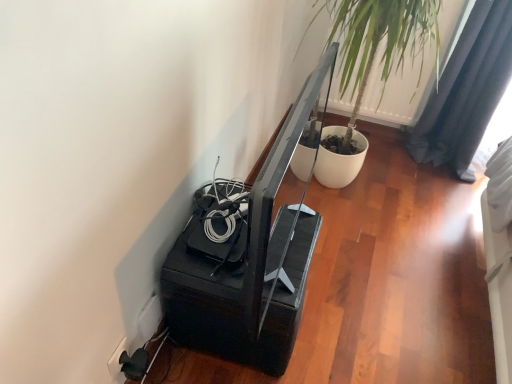
Question: Is white plastic electric outlet at lower left, arranged as the 2th electric outlet when viewed from the right, with green leafy plant at upper right?

Choices:
 (A) yes
 (B) no

Answer: (B)

Question: Can you confirm if white plastic electric outlet at lower left, arranged as the 2th electric outlet when viewed from the right, is taller than green leafy plant at upper right?

Choices:
 (A) no
 (B) yes

Answer: (A)

Question: From the image's perspective, is white plastic electric outlet at lower left, arranged as the 2th electric outlet when viewed from the right, located beneath green leafy plant at upper right?

Choices:
 (A) no
 (B) yes

Answer: (B)

Question: Is white plastic electric outlet at lower left, arranged as the 2th electric outlet when viewed from the right, to the right of green leafy plant at upper right from the viewer's perspective?

Choices:
 (A) no
 (B) yes

Answer: (A)

Question: Can green leafy plant at upper right be found inside white plastic electric outlet at lower left, the first electric outlet when ordered from left to right?

Choices:
 (A) yes
 (B) no

Answer: (B)

Question: Does point (139, 312) appear closer or farther from the camera than point (501, 57)?

Choices:
 (A) closer
 (B) farther

Answer: (A)

Question: Is white plastic electric outlet at lower left, the 2th electric outlet in the left-to-right sequence, wider or thinner than dark gray fabric curtain at upper right?

Choices:
 (A) thin
 (B) wide

Answer: (A)

Question: Is white plastic electric outlet at lower left, the 2th electric outlet in the left-to-right sequence, taller or shorter than dark gray fabric curtain at upper right?

Choices:
 (A) tall
 (B) short

Answer: (B)

Question: Considering their positions, is white plastic electric outlet at lower left, the 1th electric outlet viewed from the right, located in front of or behind dark gray fabric curtain at upper right?

Choices:
 (A) behind
 (B) front

Answer: (B)

Question: Is white plastic electric outlet at lower left, the first electric outlet when ordered from left to right, to the left or to the right of white plastic electric outlet at lower left, the 2th electric outlet in the left-to-right sequence, in the image?

Choices:
 (A) right
 (B) left

Answer: (B)

Question: Considering the positions of white plastic electric outlet at lower left, arranged as the 2th electric outlet when viewed from the right, and white plastic electric outlet at lower left, the 2th electric outlet in the left-to-right sequence, in the image, is white plastic electric outlet at lower left, arranged as the 2th electric outlet when viewed from the right, taller or shorter than white plastic electric outlet at lower left, the 2th electric outlet in the left-to-right sequence,?

Choices:
 (A) tall
 (B) short

Answer: (B)

Question: Is white plastic electric outlet at lower left, the first electric outlet when ordered from left to right, inside or outside of white plastic electric outlet at lower left, the 1th electric outlet viewed from the right?

Choices:
 (A) inside
 (B) outside

Answer: (B)

Question: From the image's perspective, is white plastic electric outlet at lower left, arranged as the 2th electric outlet when viewed from the right, positioned above or below white plastic electric outlet at lower left, the 1th electric outlet viewed from the right?

Choices:
 (A) above
 (B) below

Answer: (B)

Question: Considering the relative positions of green leafy plant at upper right and white plastic electric outlet at lower left, arranged as the 2th electric outlet when viewed from the right, in the image provided, is green leafy plant at upper right to the left or to the right of white plastic electric outlet at lower left, arranged as the 2th electric outlet when viewed from the right,?

Choices:
 (A) right
 (B) left

Answer: (A)

Question: Is green leafy plant at upper right wider or thinner than white plastic electric outlet at lower left, arranged as the 2th electric outlet when viewed from the right?

Choices:
 (A) thin
 (B) wide

Answer: (B)